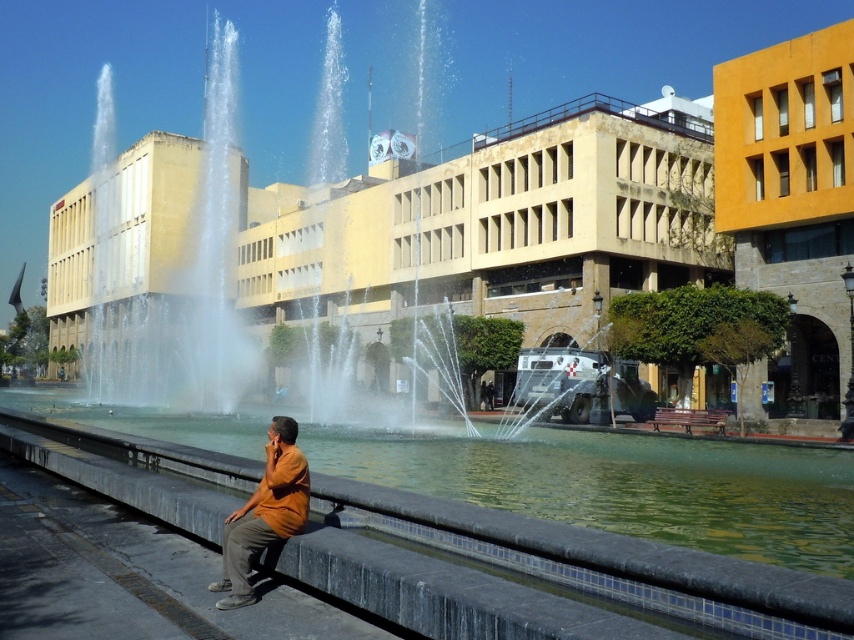
Question: Can you confirm if smooth concrete ledge at lower center is positioned below orange cotton shirt at lower center?

Choices:
 (A) no
 (B) yes

Answer: (B)

Question: Does smooth concrete ledge at lower center have a smaller size compared to orange cotton shirt at lower center?

Choices:
 (A) yes
 (B) no

Answer: (B)

Question: Among these objects, which one is farthest from the camera?

Choices:
 (A) smooth concrete ledge at lower center
 (B) orange cotton shirt at lower center

Answer: (B)

Question: In this image, where is smooth concrete ledge at lower center located relative to orange cotton shirt at lower center?

Choices:
 (A) above
 (B) below

Answer: (B)

Question: Which point is closer to the camera?

Choices:
 (A) orange cotton shirt at lower center
 (B) smooth concrete ledge at lower center

Answer: (B)